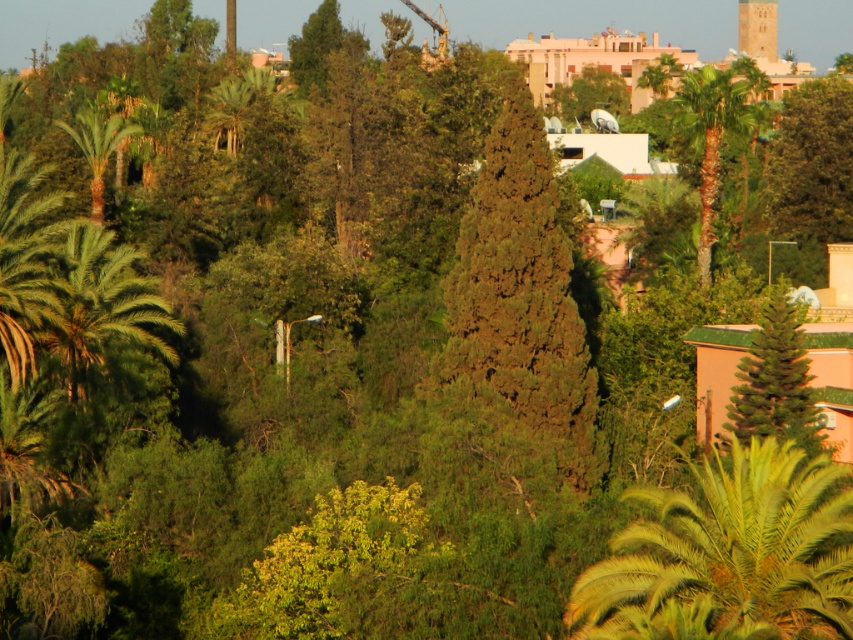
You are a GUI agent. You are given a task and a screenshot of the screen. Output one action in this format:
    pyautogui.click(x=<x>, y=<y>)
    Task: Click on the green leafy palm tree at left
    
    Given the screenshot: What is the action you would take?
    pyautogui.click(x=97, y=147)

Does green leafy palm tree at left have a larger size compared to smooth stone tower at upper right?

Indeed, green leafy palm tree at left has a larger size compared to smooth stone tower at upper right.

The image size is (853, 640). Find the location of `green leafy palm tree at left`. green leafy palm tree at left is located at coordinates (97, 147).

Does point (521, 356) lie behind point (718, 81)?

That is False.

Does point (534, 301) come in front of point (715, 99)?

Yes, point (534, 301) is closer to viewer.

Where is `green textured tree at center`? green textured tree at center is located at coordinates (521, 291).

Can you confirm if green textured tree at right is smaller than smooth stone tower at upper right?

Correct, green textured tree at right occupies less space than smooth stone tower at upper right.

Between green textured tree at right and smooth stone tower at upper right, which one is positioned lower?

green textured tree at right

The width and height of the screenshot is (853, 640). I want to click on green textured tree at right, so click(x=775, y=381).

Image resolution: width=853 pixels, height=640 pixels. Find the location of `green textured tree at right`. green textured tree at right is located at coordinates (775, 381).